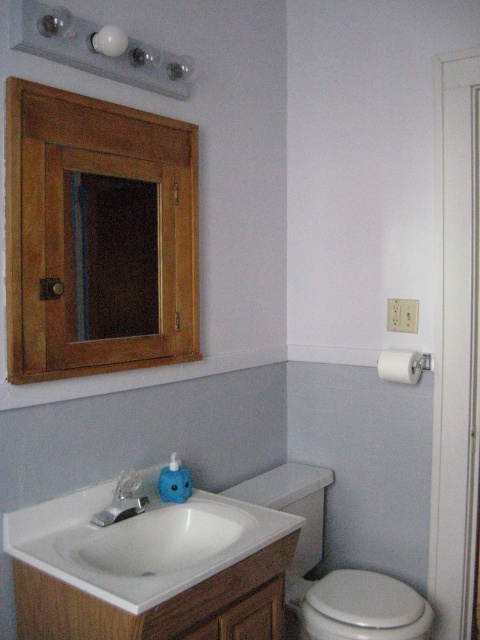
Measure the distance between point (359,595) and camera.

The distance of point (359,595) from camera is 1.93 meters.

Is point (399, 604) behind point (408, 378)?

No, it is in front of (408, 378).

I want to click on white glossy toilet at lower right, so click(363, 608).

I want to click on white glossy toilet at lower right, so click(363, 608).

Is wooden frame at upper left further to the viewer compared to white glossy toilet at lower right?

That is False.

Describe the element at coordinates (115, 256) in the screenshot. This screenshot has height=640, width=480. I see `wooden frame at upper left` at that location.

Find the location of a particular element. wooden frame at upper left is located at coordinates (115, 256).

This screenshot has height=640, width=480. Identify the location of wooden frame at upper left. (115, 256).

Between point (419, 609) and point (128, 513), which one is positioned in front?

Point (128, 513) is more forward.

Where is `white glossy toilet at lower right`? The height and width of the screenshot is (640, 480). white glossy toilet at lower right is located at coordinates (363, 608).

This screenshot has height=640, width=480. I want to click on white glossy toilet at lower right, so click(x=363, y=608).